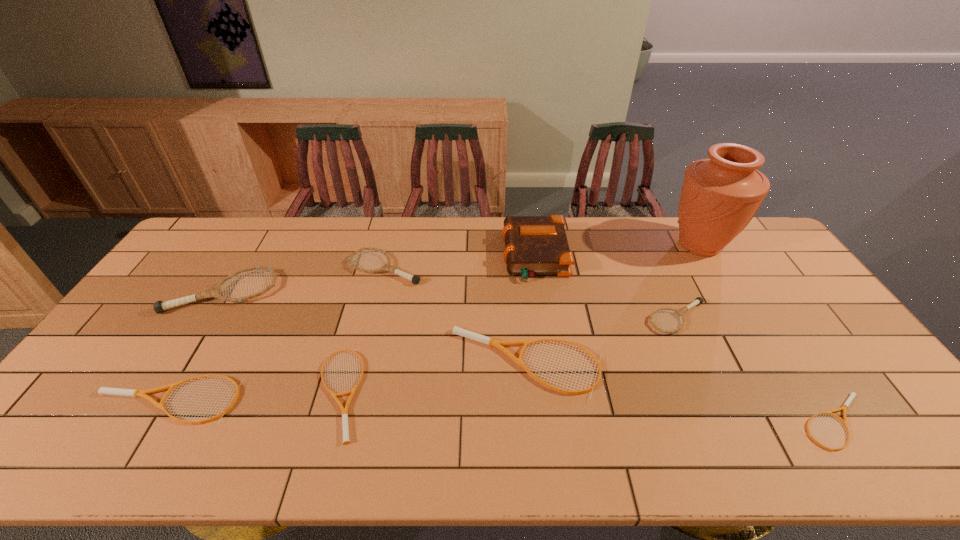
Where is `the biggest beige tennis racket`? the biggest beige tennis racket is located at coordinates (489, 341).

This screenshot has width=960, height=540. Find the location of `the leftmost beige tennis racket`. the leftmost beige tennis racket is located at coordinates (103, 390).

The image size is (960, 540). What are the coordinates of `the fifth tallest tennis racket` in the screenshot? It's located at (103, 390).

Locate an element on the screen. The width and height of the screenshot is (960, 540). the third beige tennis racket from right to left is located at coordinates (346, 441).

What are the coordinates of `the eighth tallest object` in the screenshot? It's located at [346, 441].

I want to click on the smallest beige tennis racket, so click(x=852, y=394).

Locate an element on the screen. the rightmost tennis racket is located at coordinates (852, 394).

The height and width of the screenshot is (540, 960). What are the coordinates of `vacant area located 0.050m on the right of the terracotta vase` in the screenshot? It's located at (749, 245).

Find the location of `free space located 0.280m on the spine side of the second tallest object`. free space located 0.280m on the spine side of the second tallest object is located at coordinates (421, 255).

Locate an element on the screen. The width and height of the screenshot is (960, 540). vacant space located 0.280m on the spine side of the second tallest object is located at coordinates (421, 255).